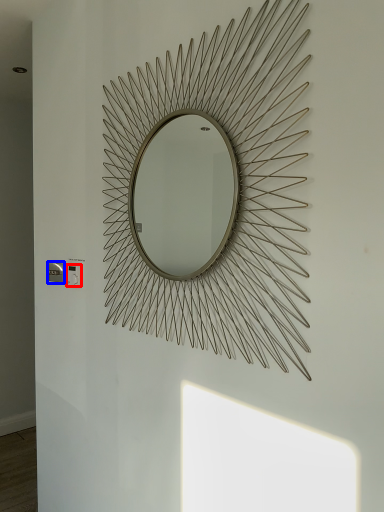
Question: Which object is closer to the camera taking this photo, electric outlet (highlighted by a red box) or electric outlet (highlighted by a blue box)?

Choices:
 (A) electric outlet
 (B) electric outlet

Answer: (A)